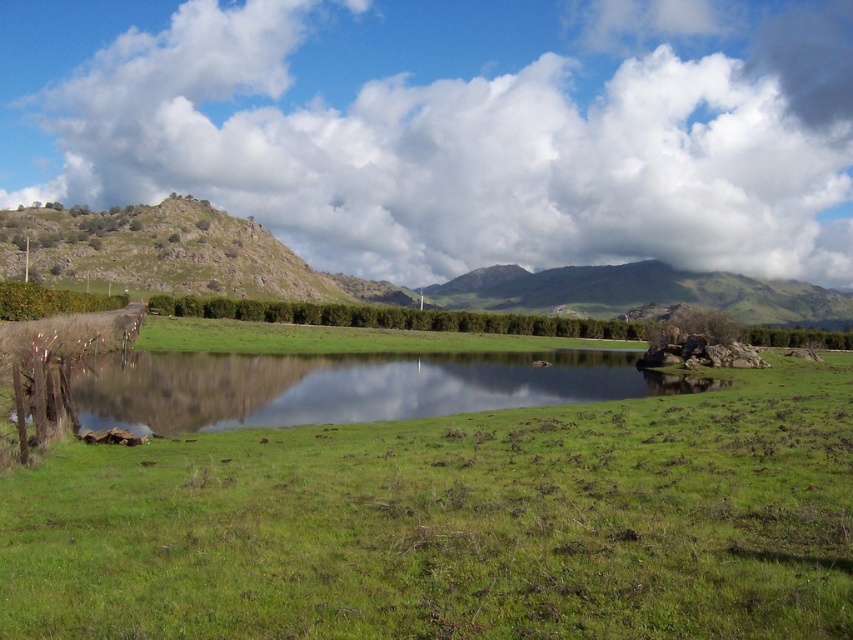
You are a gardener planning to plant flowers in the green grassy at center and the green grassy hill at center. Which area is more elevated from the ground level?

The green grassy at center is positioned under the green grassy hill at center, meaning the green grassy hill at center is higher in elevation.

In the scene shown: You are standing in the middle of the green grassy field and want to walk to the green grassy lake at center. Which direction should you head relative to the green grassy hill at center?

You should head to the left side of the green grassy hill at center because the green grassy lake at center is positioned on the left side of it.